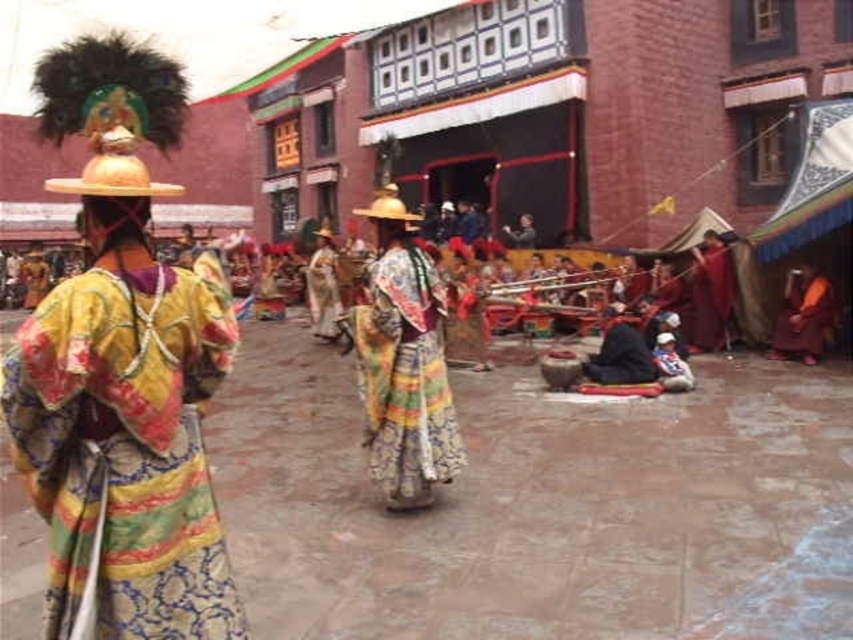
You are attending a festival and see two people wearing traditional attire. The first person is wearing a multicolored brocade robe at center and the second is wearing a multicolored silk dress at center. From your perspective, which one is positioned more to the left?

The multicolored brocade robe at center is positioned to the left of the multicolored silk dress at center, so the multicolored brocade robe at center is more to the left.

You are a photographer trying to capture both the multicolored brocade robe at center and the multicolored silk dress at center in a single shot. Since you want the robe to be the main focus, which one should you adjust your camera position to prioritize?

The multicolored brocade robe at center is closer to the viewer than the multicolored silk dress at center, so you should position your camera closer to the robe to ensure it remains the main focus while still capturing the dress in the background.

You are a photographer trying to capture both the multicolored brocade robe at center and the multicolored silk dress at center in a single frame. Which clothing item will appear shorter in your photo?

The multicolored brocade robe at center will appear shorter in the photo because it has a lesser height compared to the multicolored silk dress at center.